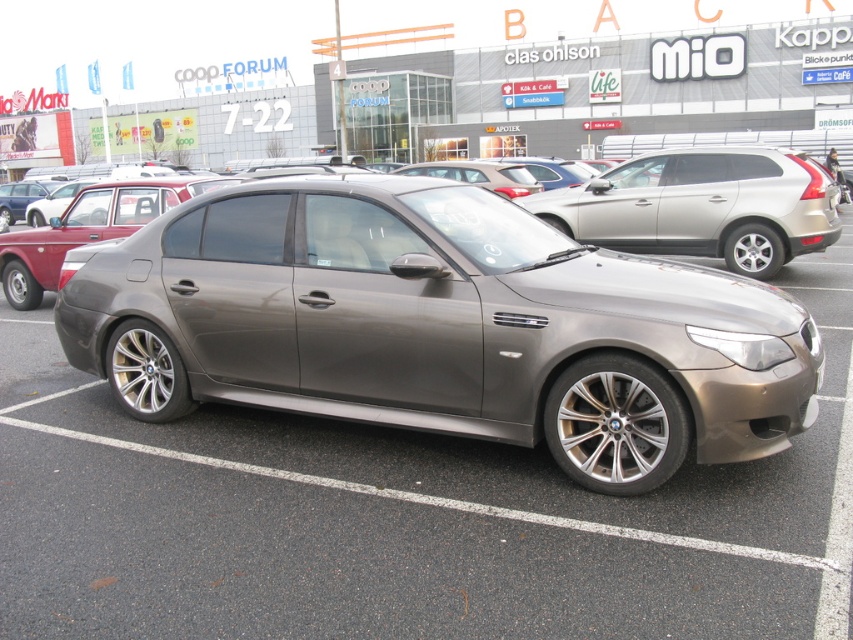
Question: Does metallic gray car at center appear over satin metallic car at center?

Choices:
 (A) yes
 (B) no

Answer: (B)

Question: Which point is closer to the camera taking this photo?

Choices:
 (A) (762, 211)
 (B) (477, 177)
 (C) (337, 486)

Answer: (C)

Question: Which point appears closest to the camera in this image?

Choices:
 (A) (714, 202)
 (B) (799, 630)

Answer: (B)

Question: Is satin silver car at center wider than satin metallic car at center?

Choices:
 (A) yes
 (B) no

Answer: (A)

Question: Which of these objects is positioned closest to the satin silver car at center?

Choices:
 (A) satin metallic car at center
 (B) metallic gray car at center

Answer: (A)

Question: Is satin silver car at center above satin metallic car at center?

Choices:
 (A) yes
 (B) no

Answer: (B)